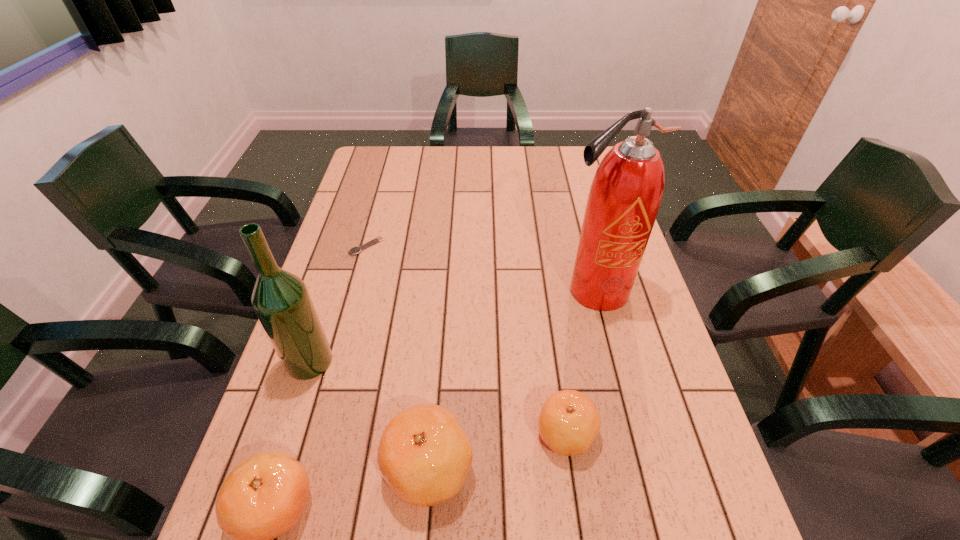
Select which object appears as the closest to the third shortest object. Please provide its 2D coordinates. Your answer should be formatted as a tuple, i.e. [(x, y)], where the tuple contains the x and y coordinates of a point satisfying the conditions above.

[(424, 455)]

Select which object appears as the third closest to the second shortest object. Please provide its 2D coordinates. Your answer should be formatted as a tuple, i.e. [(x, y)], where the tuple contains the x and y coordinates of a point satisfying the conditions above.

[(264, 496)]

Identify which clementine is the second closest to the alcohol. Please provide its 2D coordinates. Your answer should be formatted as a tuple, i.e. [(x, y)], where the tuple contains the x and y coordinates of a point satisfying the conditions above.

[(424, 455)]

This screenshot has width=960, height=540. I want to click on clementine that is the third closest to the second farthest object, so click(264, 496).